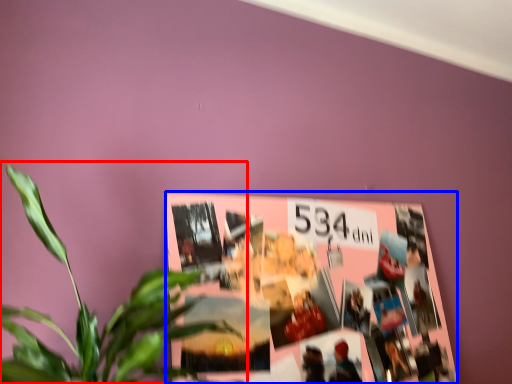
Question: Which object is further to the camera taking this photo, houseplant (highlighted by a red box) or bulletin board (highlighted by a blue box)?

Choices:
 (A) houseplant
 (B) bulletin board

Answer: (B)